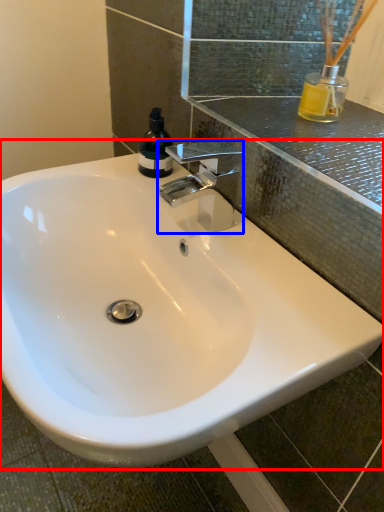
Question: Which of the following is the closest to the observer, sink (highlighted by a red box) or tap (highlighted by a blue box)?

Choices:
 (A) sink
 (B) tap

Answer: (A)